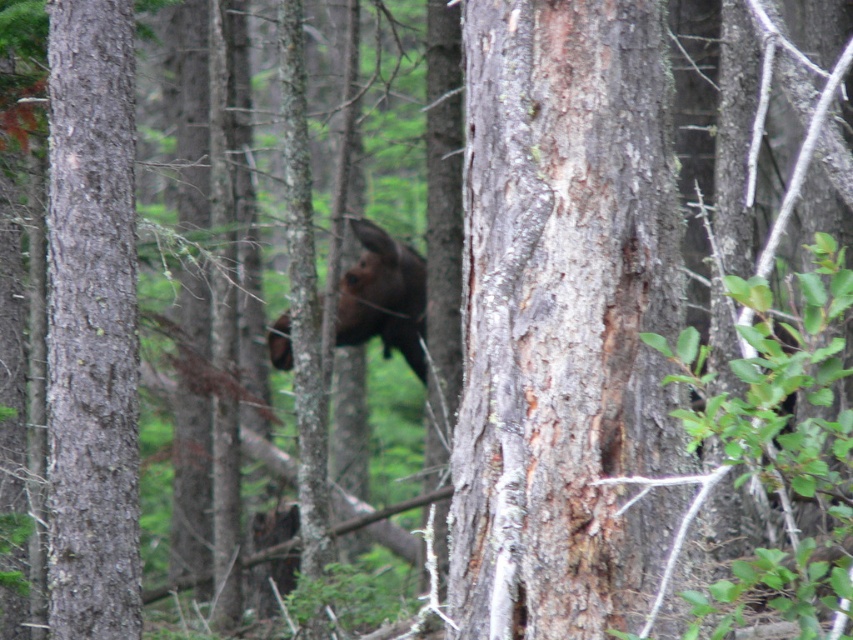
Which of these two, gray rough bark tree trunk at center or brown furry moose at center, stands taller?

gray rough bark tree trunk at center

Who is lower down, gray rough bark tree trunk at center or brown furry moose at center?

gray rough bark tree trunk at center is below.

Describe the element at coordinates (564, 320) in the screenshot. I see `gray rough bark tree trunk at center` at that location.

Image resolution: width=853 pixels, height=640 pixels. I want to click on gray rough bark tree trunk at center, so click(x=564, y=320).

Measure the distance between smooth brown tree trunk at left and brown furry moose at center.

They are 21.92 feet apart.

Is the position of smooth brown tree trunk at left less distant than that of brown furry moose at center?

Yes, smooth brown tree trunk at left is in front of brown furry moose at center.

Describe the element at coordinates (91, 323) in the screenshot. The height and width of the screenshot is (640, 853). I see `smooth brown tree trunk at left` at that location.

Locate an element on the screen. Image resolution: width=853 pixels, height=640 pixels. smooth brown tree trunk at left is located at coordinates (91, 323).

Who is positioned more to the left, gray rough bark tree trunk at center or smooth brown tree trunk at left?

smooth brown tree trunk at left is more to the left.

Can you confirm if gray rough bark tree trunk at center is bigger than smooth brown tree trunk at left?

Indeed, gray rough bark tree trunk at center has a larger size compared to smooth brown tree trunk at left.

Is point (648, 244) positioned before point (62, 532)?

That is True.

This screenshot has width=853, height=640. What are the coordinates of `gray rough bark tree trunk at center` in the screenshot? It's located at (564, 320).